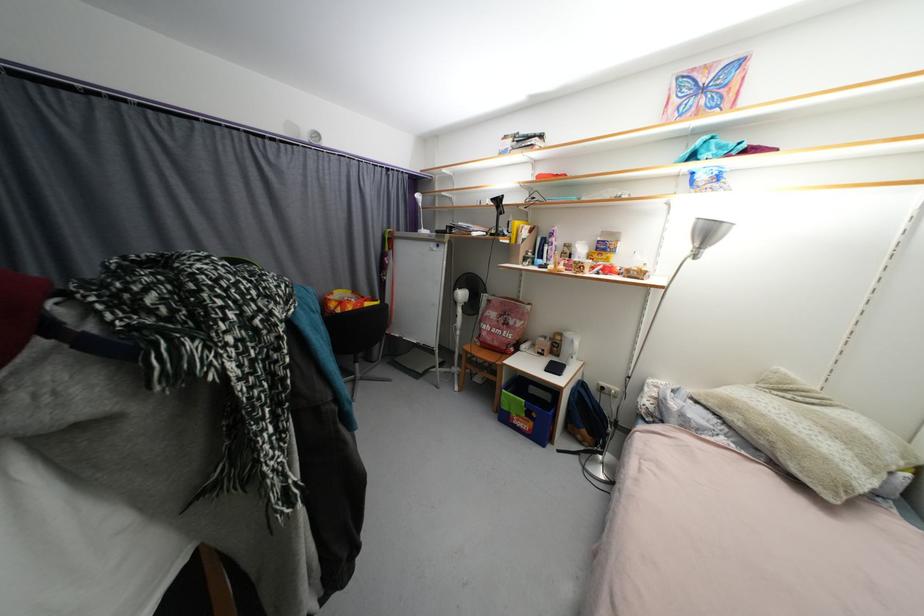
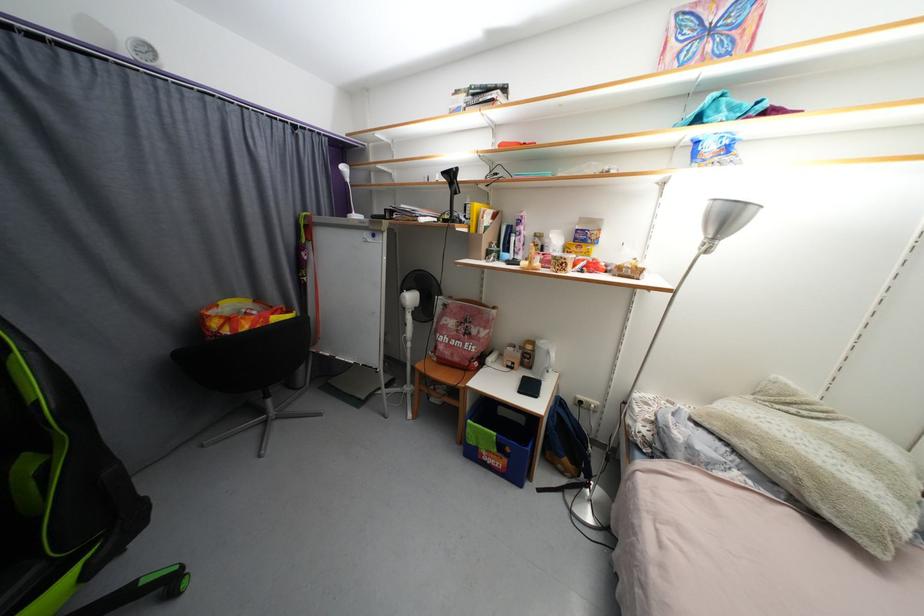
Find the pixel in the second image that matches [586,445] in the first image.

(567, 475)